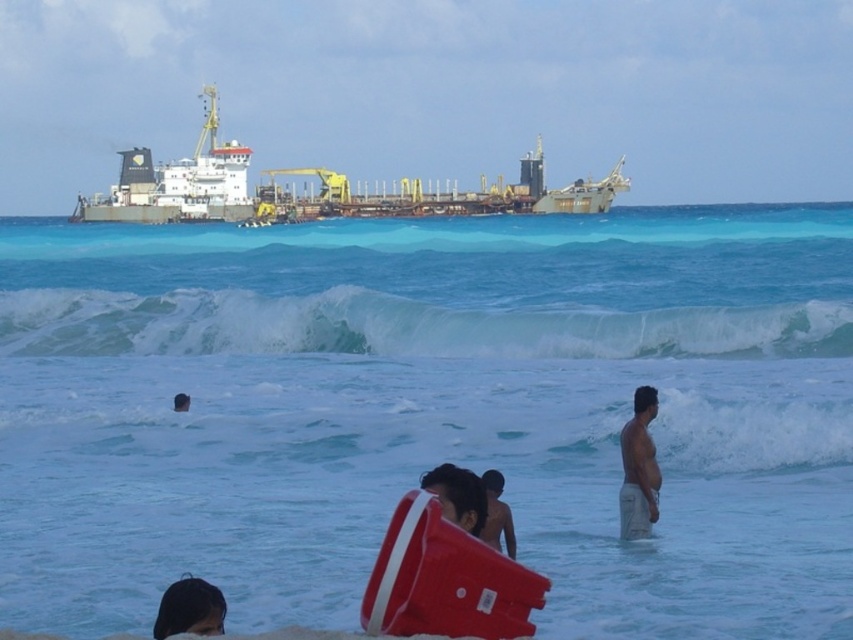
Can you confirm if green metallic ship at upper center is positioned below dark brown hair at lower center?

Actually, green metallic ship at upper center is above dark brown hair at lower center.

From the picture: Measure the distance between green metallic ship at upper center and camera.

They are 197.45 meters apart.

Locate an element on the screen. green metallic ship at upper center is located at coordinates (318, 189).

Who is lower down, blue water at center or white frothy wave at upper center?

white frothy wave at upper center is lower down.

Is blue water at center bigger than white frothy wave at upper center?

Indeed, blue water at center has a larger size compared to white frothy wave at upper center.

Which is behind, point (741, 452) or point (387, 344)?

Positioned behind is point (387, 344).

This screenshot has height=640, width=853. Identify the location of blue water at center. (428, 412).

Which is in front, point (260, 556) or point (457, 520)?

Point (457, 520)

Can you confirm if blue water at center is bigger than dark brown hair at center?

Yes.

Identify the location of blue water at center. (428, 412).